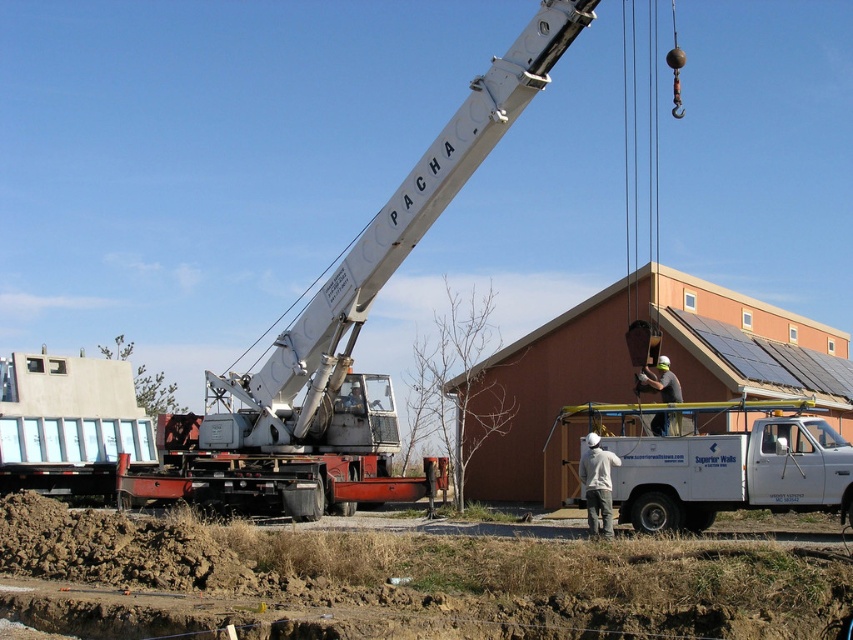
Question: Which of the following is the closest to the observer?

Choices:
 (A) (602, 508)
 (B) (671, 428)
 (C) (764, 401)

Answer: (A)

Question: Considering the relative positions of white matte truck at center and gray fabric construction worker at center in the image provided, where is white matte truck at center located with respect to gray fabric construction worker at center?

Choices:
 (A) below
 (B) above

Answer: (A)

Question: Which point is farther from the camera taking this photo?

Choices:
 (A) (604, 483)
 (B) (663, 394)
 (C) (811, 451)

Answer: (B)

Question: Is white matte helmet at center closer to camera compared to gray fabric construction worker at center?

Choices:
 (A) no
 (B) yes

Answer: (B)

Question: Which of the following is the farthest from the observer?

Choices:
 (A) white matte truck at center
 (B) gray fabric construction worker at center

Answer: (B)

Question: Does white matte truck at center lie in front of gray fabric construction worker at center?

Choices:
 (A) no
 (B) yes

Answer: (B)